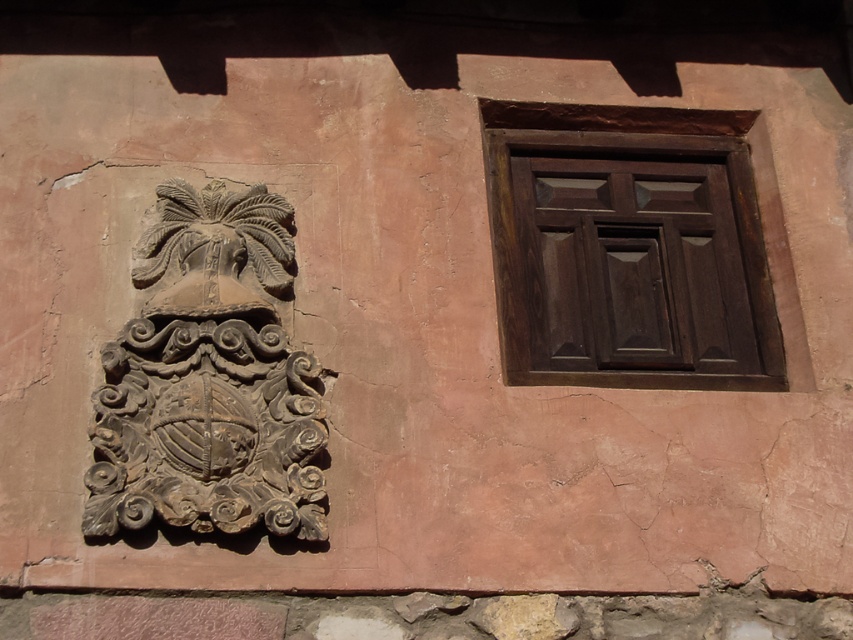
You are standing in front of the building and want to touch both the dark wood window at upper right and the dark brown stone crest at left. Which object will you reach first?

You will reach the dark wood window at upper right first because it is closer to you than the dark brown stone crest at left, which is further away.

You are a painter standing at the base of the building. You need to paint both the dark wood window at upper right and the stone emblem to its left. If you have a ladder that can reach up to 10 meters, will you be able to paint both objects without moving the ladder?

The dark wood window at upper right and the stone emblem to its left are 12.69 meters apart. Since your ladder can only reach up to 10 meters, you will not be able to paint both objects without moving the ladder.

You are standing in front of a building and see the dark wood window at upper right and the dark brown stone crest at left. Which object is located higher up on the wall?

The dark wood window at upper right is positioned over the dark brown stone crest at left, so it is higher up on the wall.